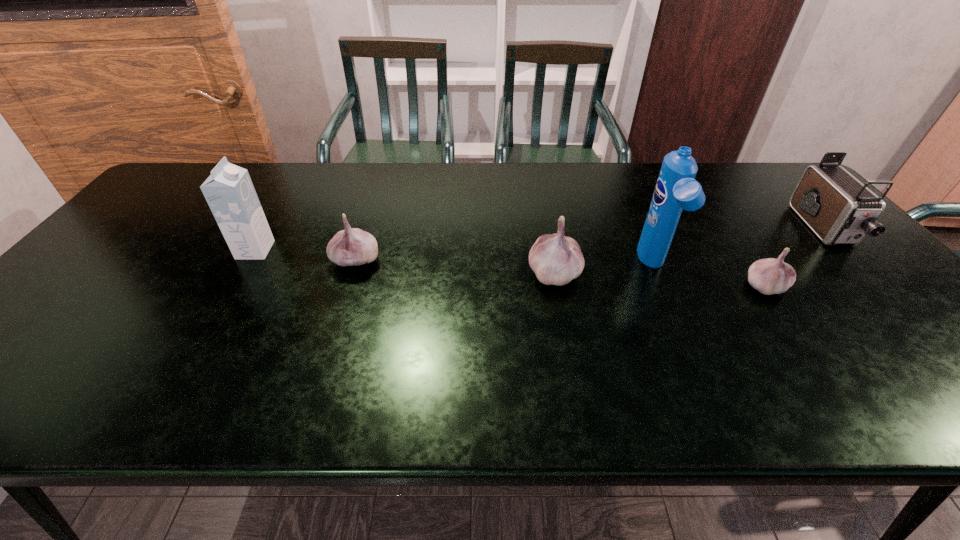
At what (x,y) coordinates should I click in order to perform the action: click on vacant space at the far right corner. Please return your answer as a coordinate pair (x, y). Image resolution: width=960 pixels, height=540 pixels. Looking at the image, I should click on (773, 174).

Identify the location of vacant region between the fifth object from right to left and the third object from right to left. (505, 264).

What are the coordinates of `blank region between the tallest object and the second garlic from left to right` in the screenshot? It's located at (604, 269).

This screenshot has width=960, height=540. I want to click on free space between the fifth object from left to right and the rightmost object, so click(x=794, y=258).

Locate an element on the screen. unoccupied area between the tallest object and the second object from left to right is located at coordinates (505, 264).

Image resolution: width=960 pixels, height=540 pixels. I want to click on free space between the second object from right to left and the second tallest object, so click(x=510, y=268).

Find the location of a particular element. This screenshot has height=540, width=960. free space between the second object from right to left and the leftmost object is located at coordinates (510, 268).

This screenshot has width=960, height=540. I want to click on unoccupied area between the shampoo and the second object from right to left, so click(709, 276).

This screenshot has height=540, width=960. What are the coordinates of `unoccupied position between the fourth object from right to left and the rightmost object` in the screenshot? It's located at (688, 251).

Where is `free area in between the carton and the second object from right to left`? free area in between the carton and the second object from right to left is located at coordinates (510, 268).